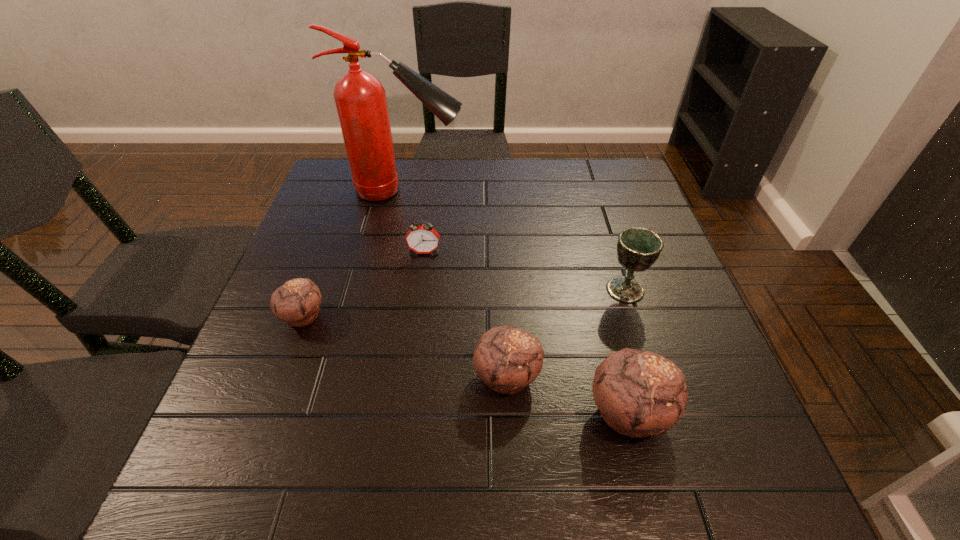
Locate an element on the screen. The image size is (960, 540). free region located on the right of the second muffin from left to right is located at coordinates (679, 376).

Locate an element on the screen. The height and width of the screenshot is (540, 960). vacant area situated 0.300m on the left of the tallest muffin is located at coordinates (417, 413).

Find the location of a particular element. The image size is (960, 540). vacant space located 0.260m at the nozzle end of the farthest object is located at coordinates (556, 191).

The height and width of the screenshot is (540, 960). I want to click on free space located 0.400m on the clock face of the fifth nearest object, so click(x=404, y=408).

Locate an element on the screen. This screenshot has height=540, width=960. vacant space positioned on the back of the chalice is located at coordinates (616, 261).

Locate an element on the screen. object positioned at the far edge is located at coordinates tap(360, 99).

Identify the location of muffin that is at the left edge. This screenshot has width=960, height=540. (297, 302).

The width and height of the screenshot is (960, 540). I want to click on fire extinguisher that is at the left edge, so click(360, 99).

I want to click on muffin that is at the right edge, so click(639, 393).

Where is `chalice at the right edge`? chalice at the right edge is located at coordinates coord(638,248).